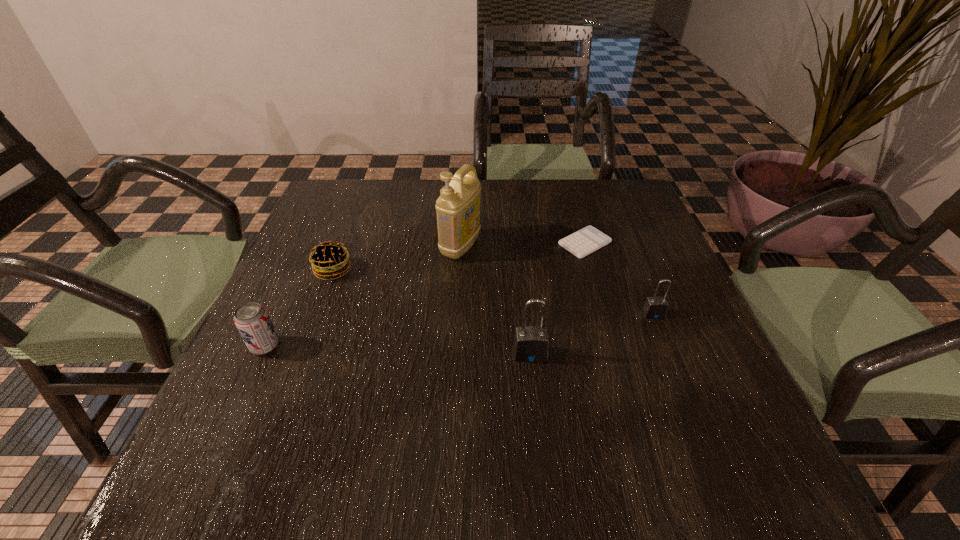
The height and width of the screenshot is (540, 960). I want to click on vacant spot to place a padlock on the left, so click(382, 402).